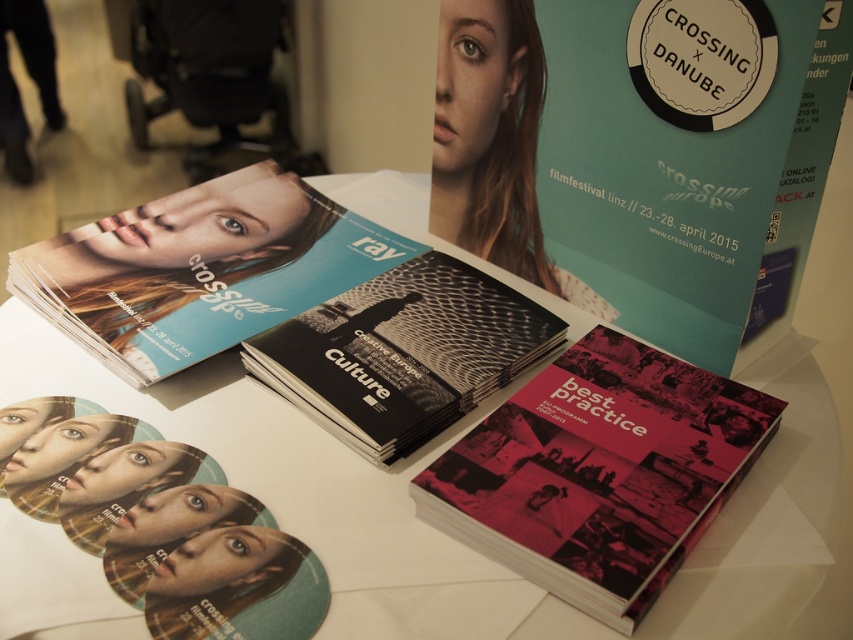
Does matte blue magazine at center appear under black matte culture magazine at center?

No.

Between matte blue magazine at center and black matte culture magazine at center, which one is positioned higher?

Positioned higher is matte blue magazine at center.

Does point (70, 248) lie behind point (323, 332)?

Yes, point (70, 248) is behind point (323, 332).

Identify the location of matte blue magazine at center. [200, 269].

Can you confirm if matte plastic circular stickers at lower left is positioned to the left of black matte culture magazine at center?

Yes, matte plastic circular stickers at lower left is to the left of black matte culture magazine at center.

Find the location of a particular element. matte plastic circular stickers at lower left is located at coordinates pyautogui.click(x=160, y=524).

Does point (236, 580) come in front of point (357, 416)?

Yes, point (236, 580) is closer to viewer.

Find the location of a particular element. Image resolution: width=853 pixels, height=640 pixels. matte plastic circular stickers at lower left is located at coordinates (160, 524).

Looking at this image, is matte pink book at center further to the viewer compared to matte blue magazine at center?

No.

Can you confirm if matte pink book at center is smaller than matte blue magazine at center?

Indeed, matte pink book at center has a smaller size compared to matte blue magazine at center.

Is point (680, 406) closer to viewer compared to point (288, 284)?

Yes, it is in front of point (288, 284).

I want to click on matte pink book at center, so click(599, 472).